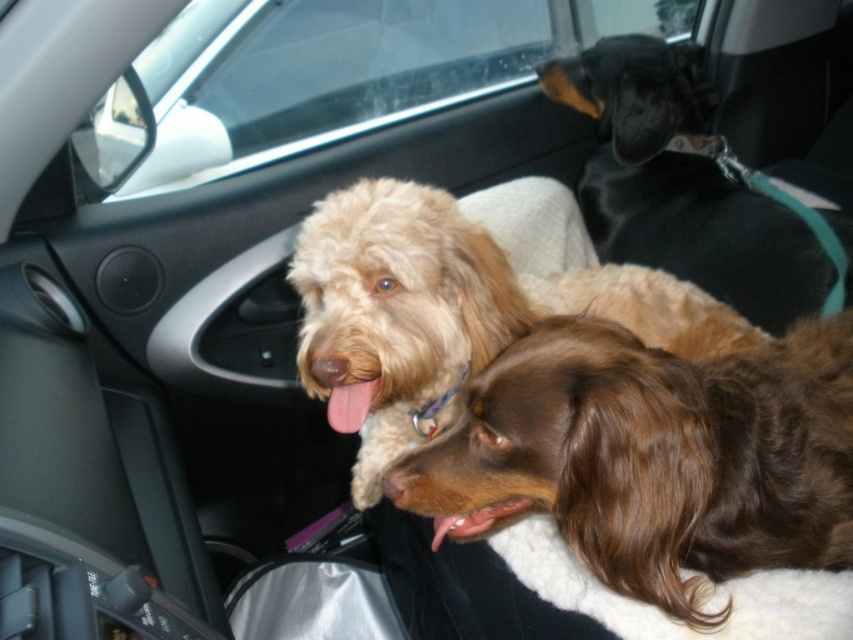
Question: Does light brown fur at center have a smaller size compared to black leather dog at upper right?

Choices:
 (A) yes
 (B) no

Answer: (A)

Question: Does light brown fur at center have a greater width compared to transparent glass car window at upper center?

Choices:
 (A) no
 (B) yes

Answer: (A)

Question: Estimate the real-world distances between objects in this image. Which object is farther from the brown silky dog at center?

Choices:
 (A) transparent glass car window at upper center
 (B) black leather dog at upper right
 (C) light brown fur at center

Answer: (A)

Question: Which point is farther to the camera?

Choices:
 (A) (434, 221)
 (B) (575, 6)
 (C) (645, 481)

Answer: (B)

Question: Which point is closer to the camera?

Choices:
 (A) (769, 216)
 (B) (809, 332)
 (C) (376, 321)
 (D) (666, 3)

Answer: (C)

Question: Does transparent glass car window at upper center appear over black leather dog at upper right?

Choices:
 (A) no
 (B) yes

Answer: (B)